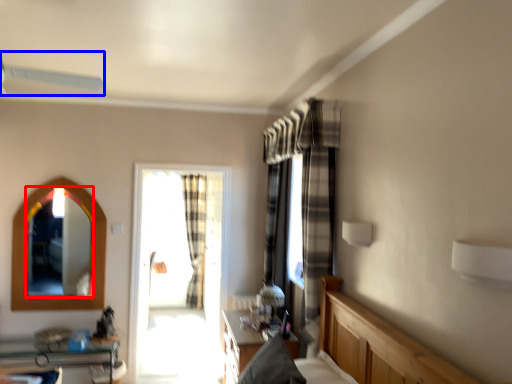
Question: Which object is closer to the camera taking this photo, mirror (highlighted by a red box) or fan (highlighted by a blue box)?

Choices:
 (A) mirror
 (B) fan

Answer: (B)